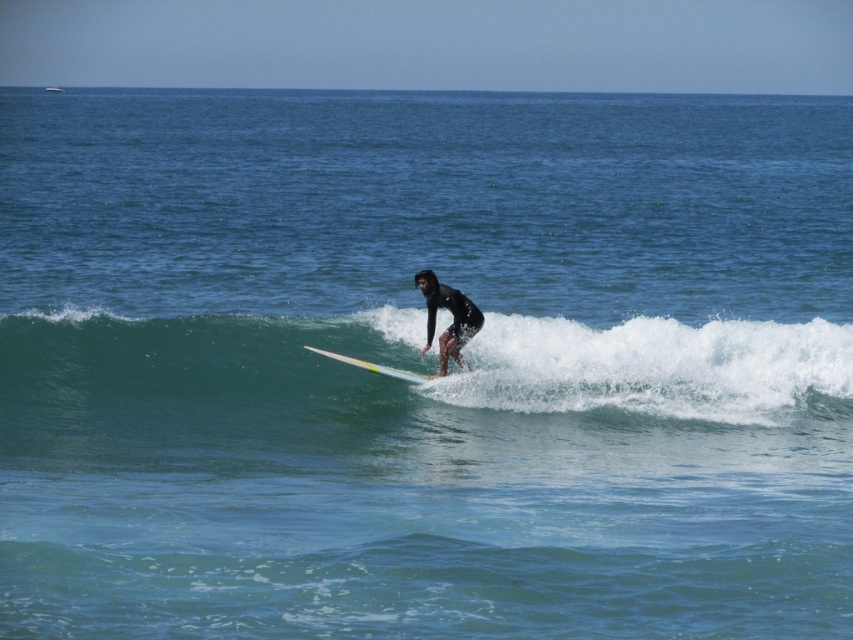
Does green rubber wave at center have a lesser height compared to black wetsuit surfer at center?

In fact, green rubber wave at center may be taller than black wetsuit surfer at center.

Does point (560, 339) come behind point (432, 332)?

Yes, it is behind point (432, 332).

Image resolution: width=853 pixels, height=640 pixels. What are the coordinates of `green rubber wave at center` in the screenshot? It's located at (407, 369).

Can you confirm if green rubber wave at center is positioned above yellow glossy surfboard at center?

Yes, green rubber wave at center is above yellow glossy surfboard at center.

Can you confirm if green rubber wave at center is taller than yellow glossy surfboard at center?

Correct, green rubber wave at center is much taller as yellow glossy surfboard at center.

This screenshot has width=853, height=640. Identify the location of green rubber wave at center. (407, 369).

Who is more distant from viewer, (454, 323) or (352, 358)?

Point (352, 358)

Is black wetsuit surfer at center thinner than yellow glossy surfboard at center?

Yes, black wetsuit surfer at center is thinner than yellow glossy surfboard at center.

Is point (426, 276) closer to camera compared to point (416, 380)?

No, (426, 276) is further to viewer.

Locate an element on the screen. The width and height of the screenshot is (853, 640). black wetsuit surfer at center is located at coordinates (451, 317).